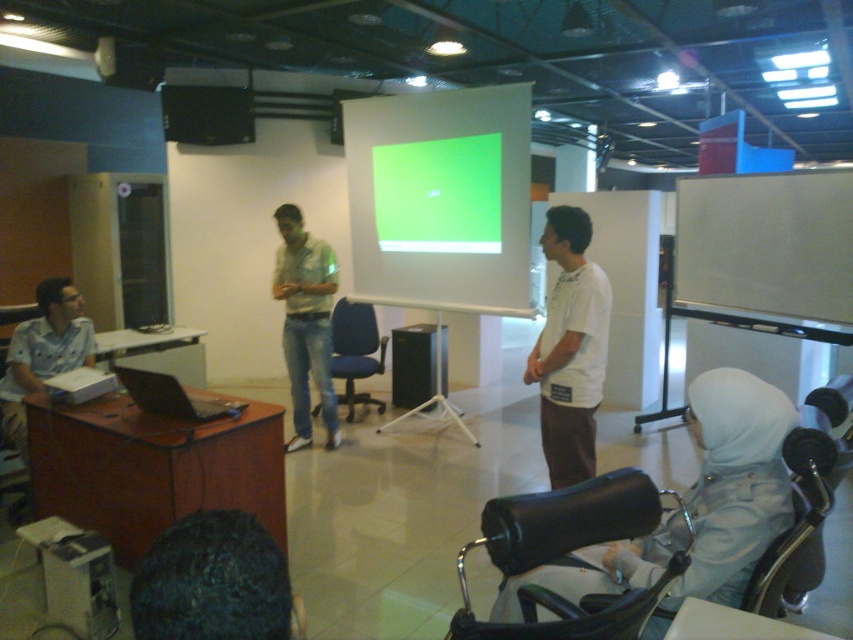
You are a guest speaker in the classroom and need to check your notes on the matte white laptop at left while facing the audience. Can you see the dark curly hair at lower left of the laptop in your line of sight?

The dark curly hair at lower left is below the matte white laptop at left, so when you look at the laptop, the hair would be positioned below it and likely within your line of sight.

You are standing in the room and want to see both the dark curly hair at lower left and the matte white laptop at left. Which one is positioned more to the right side?

The dark curly hair at lower left is positioned to the right of the matte white laptop at left.